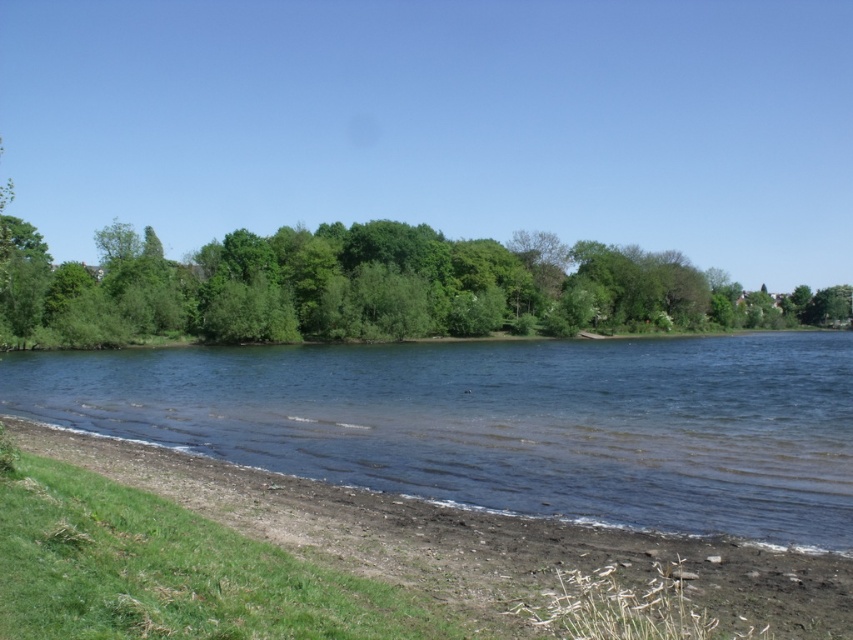
You are standing on the lakeside and want to cross to the other side. You see clear water at center and green leafy trees at center. Which direction should you head to avoid the trees and reach the water first?

You should head to the right direction since the clear water at center is to the right of the green leafy trees at center, so moving right will take you away from the trees and towards the water first.

You are standing at the point with coordinates (503, 422) in the lakeside scene. What type of terrain or surface are you currently standing on?

You are standing on clear water at center located at point (503, 422).

You are planning to build a small garden in the area shown in the image. The garden requires a space that is wider than the brown dirt at lower center. Can the green leafy trees at center provide enough width for this garden?

The green leafy trees at center might be wider than brown dirt at lower center, so there is a possibility that the garden can be placed there if the trees are indeed wider. However, further measurement is needed to confirm.